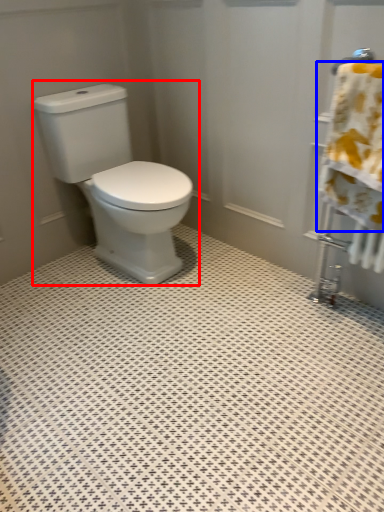
Question: Which object is closer to the camera taking this photo, toilet (highlighted by a red box) or bath towel (highlighted by a blue box)?

Choices:
 (A) toilet
 (B) bath towel

Answer: (B)